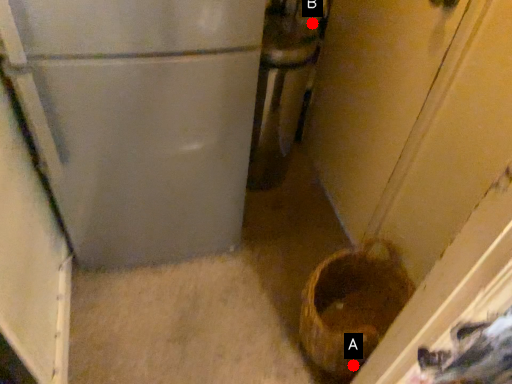
Question: Two points are circled on the image, labeled by A and B beside each circle. Which of the following is the closest to the observer?

Choices:
 (A) A is closer
 (B) B is closer

Answer: (A)